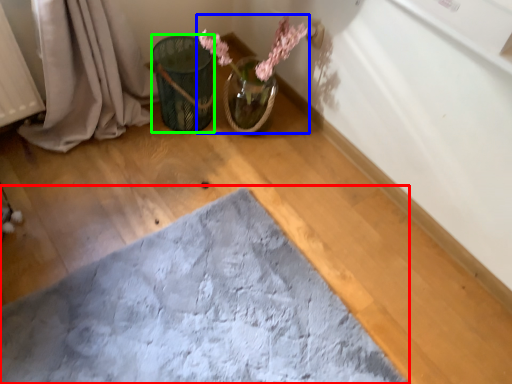
Question: Which object is positioned closest to bath mat (highlighted by a red box)? Select from floral arrangement (highlighted by a blue box) and flower basket (highlighted by a green box).

Choices:
 (A) floral arrangement
 (B) flower basket

Answer: (B)